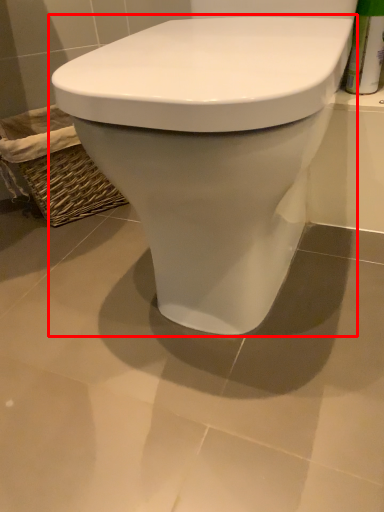
Question: From the image's perspective, what is the correct spatial positioning of toilet (annotated by the red box) in reference to basket?

Choices:
 (A) above
 (B) below

Answer: (B)